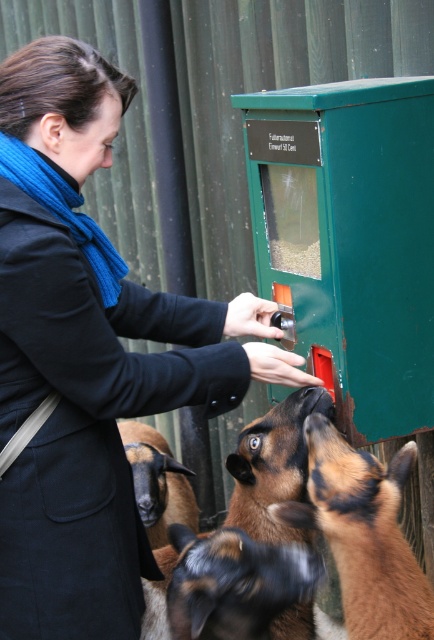
Is brown furry goat at center wider than brown woolen goat at lower center?

In fact, brown furry goat at center might be narrower than brown woolen goat at lower center.

Can you confirm if brown furry goat at center is positioned above brown woolen goat at lower center?

Correct, brown furry goat at center is located above brown woolen goat at lower center.

Between point (278, 416) and point (188, 499), which one is positioned in front?

Point (278, 416)

Where is `brown furry goat at center`? The width and height of the screenshot is (434, 640). brown furry goat at center is located at coordinates (273, 467).

Does point (30, 106) lie in front of point (279, 476)?

Yes, point (30, 106) is in front of point (279, 476).

Between point (168, 381) and point (291, 609), which one is positioned in front?

Point (168, 381) is more forward.

Where is `blue wool scarf at upper left`? This screenshot has width=434, height=640. blue wool scarf at upper left is located at coordinates (89, 355).

Who is taller, blue wool scarf at upper left or brown woolen goat at lower center?

blue wool scarf at upper left

Between point (16, 516) and point (155, 500), which one is positioned behind?

Point (155, 500)

Find the location of a particular element. This screenshot has height=640, width=434. blue wool scarf at upper left is located at coordinates (89, 355).